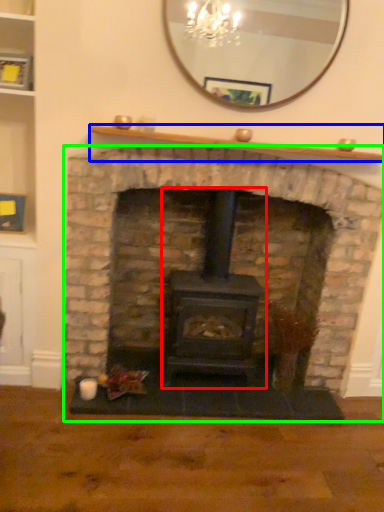
Question: Which object is the closest to the wood burning stove (highlighted by a red box)? Choose among these: mantle (highlighted by a blue box) or fireplace (highlighted by a green box).

Choices:
 (A) mantle
 (B) fireplace

Answer: (B)